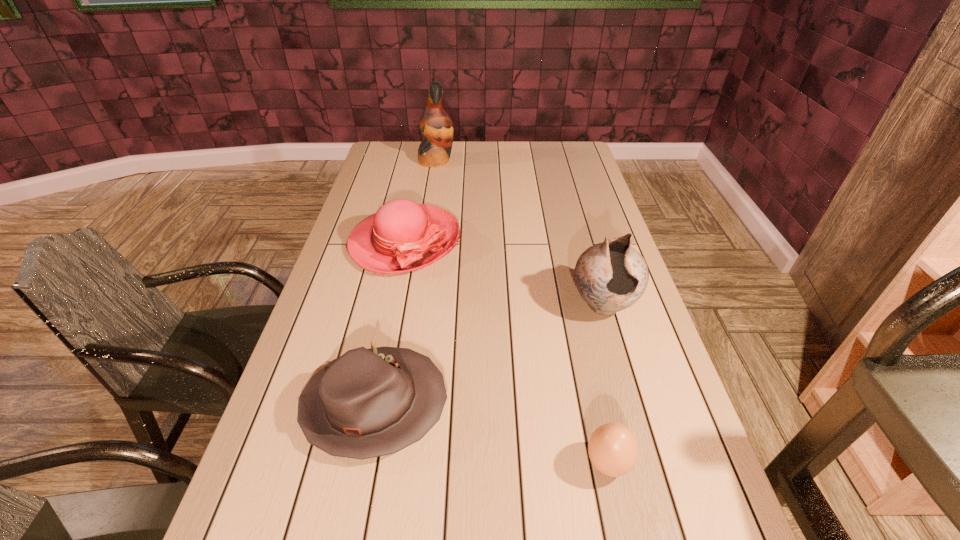
Identify the location of free space that satisfies the following two spatial constraints: 1. on the face of the boiled egg; 2. on the right side of the parrot. (390, 463).

This screenshot has width=960, height=540. Identify the location of vacant space that satisfies the following two spatial constraints: 1. at the front of the boiled egg with a bow; 2. on the left side of the taller hat. (359, 463).